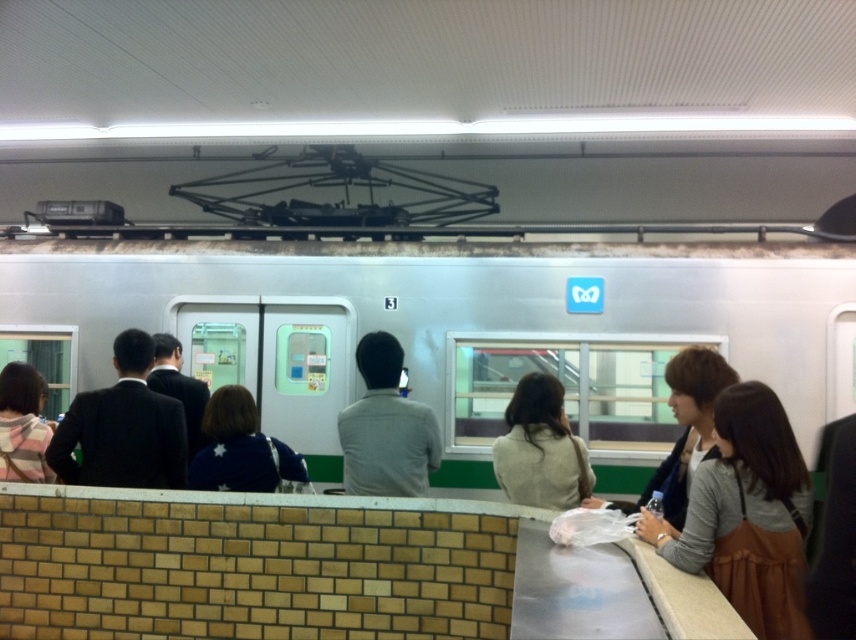
Question: Which object appears farthest from the camera in this image?

Choices:
 (A) silver metallic train at center
 (B) dark gray suit at center
 (C) gray matte shirt at center

Answer: (A)

Question: Observing the image, what is the correct spatial positioning of gray matte shirt at center in reference to dark brown hair at center?

Choices:
 (A) left
 (B) right

Answer: (A)

Question: Is gray matte shirt at center to the right of light beige sweater at center from the viewer's perspective?

Choices:
 (A) no
 (B) yes

Answer: (A)

Question: Does blue knit sweater at center appear on the right side of dark brown hair at center?

Choices:
 (A) yes
 (B) no

Answer: (B)

Question: Which of the following is the closest to the observer?

Choices:
 (A) (694, 356)
 (B) (210, 253)
 (C) (254, 488)
 (D) (755, 588)

Answer: (D)

Question: Which point appears closest to the camera in this image?

Choices:
 (A) (9, 396)
 (B) (782, 420)

Answer: (B)